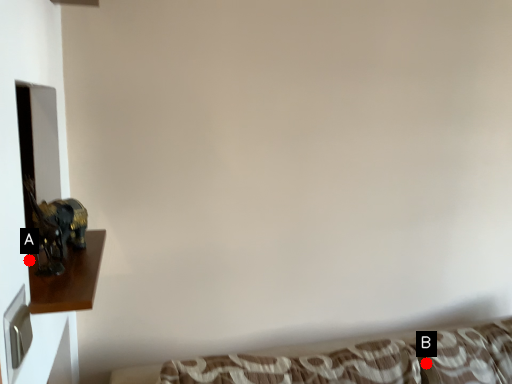
Question: Two points are circled on the image, labeled by A and B beside each circle. Which point appears farthest from the camera in this image?

Choices:
 (A) A is further
 (B) B is further

Answer: (B)